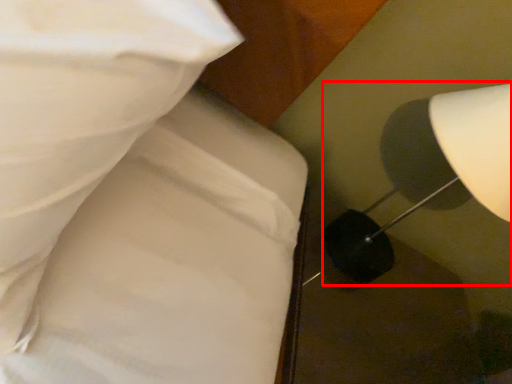
Question: From the image's perspective, where is lamp (annotated by the red box) located relative to bed?

Choices:
 (A) below
 (B) above

Answer: (B)